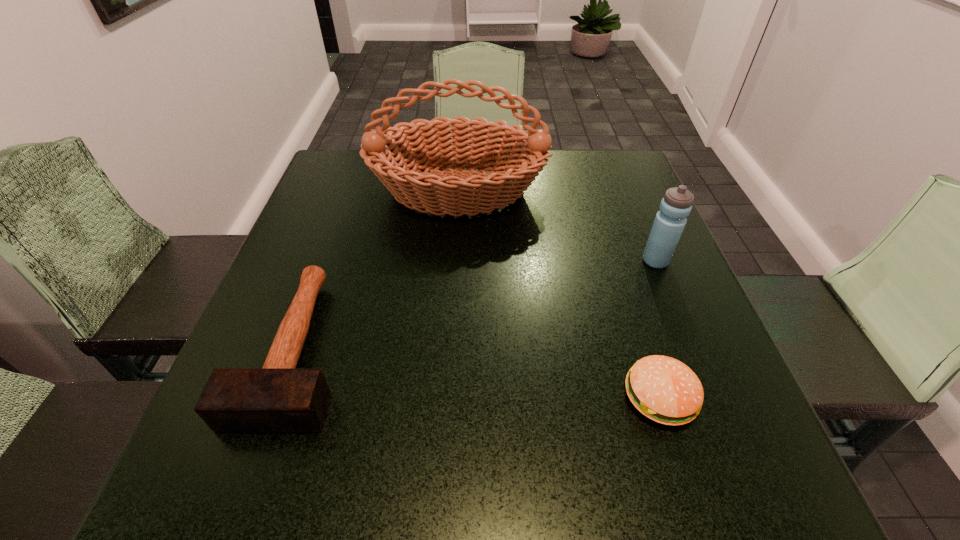
This screenshot has height=540, width=960. Identify the location of object that is at the far edge. (419, 147).

Locate an element on the screen. This screenshot has height=540, width=960. basket that is at the left edge is located at coordinates (419, 147).

At what (x,y) coordinates should I click in order to perform the action: click on mallet at the left edge. Please return your answer as a coordinate pair (x, y). This screenshot has height=540, width=960. Looking at the image, I should click on (278, 397).

Locate an element on the screen. Image resolution: width=960 pixels, height=540 pixels. water bottle that is at the right edge is located at coordinates (676, 205).

Image resolution: width=960 pixels, height=540 pixels. I want to click on patty present at the right edge, so click(x=665, y=390).

Where is `object that is at the far left corner`? The image size is (960, 540). object that is at the far left corner is located at coordinates (419, 147).

At what (x,y) coordinates should I click in order to perform the action: click on free space at the far edge of the desktop. Please return your answer as a coordinate pair (x, y). This screenshot has width=960, height=540. Looking at the image, I should click on [x=538, y=176].

This screenshot has width=960, height=540. I want to click on vacant space at the near edge, so click(x=659, y=504).

Where is `vacant space at the left edge`? vacant space at the left edge is located at coordinates (347, 199).

Identify the location of free region at the right edge. The width and height of the screenshot is (960, 540). [610, 212].